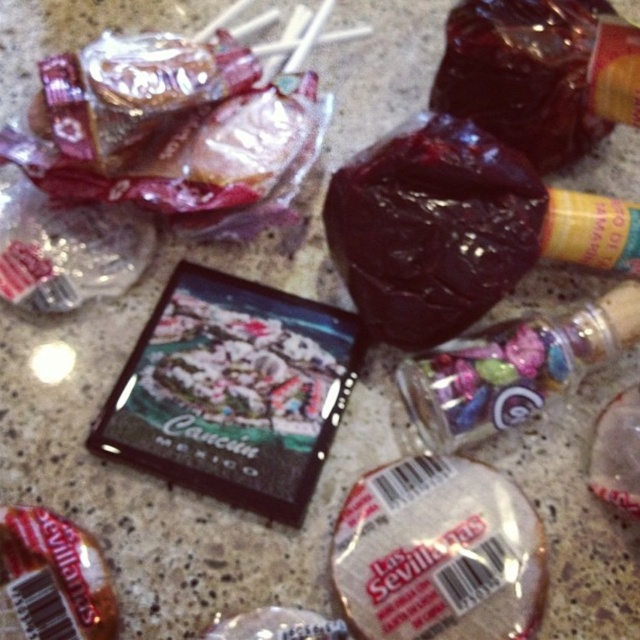
Question: Estimate the real-world distances between objects in this image. Which object is closer to the shiny dark chocolate at center?

Choices:
 (A) translucent glass jar at center-right
 (B) shiny dark red jelly at center

Answer: (A)

Question: Is white matte cookie at center bigger than translucent glass jar at center-right?

Choices:
 (A) yes
 (B) no

Answer: (B)

Question: In this image, where is shiny dark chocolate at center located relative to translucent glass jar at center-right?

Choices:
 (A) left
 (B) right

Answer: (A)

Question: Which object is positioned farthest from the shiny dark chocolate at center?

Choices:
 (A) shiny dark red jelly at center
 (B) white matte cookie at center
 (C) brown matte chocolate at center

Answer: (C)

Question: Which object appears closest to the camera in this image?

Choices:
 (A) shiny dark red jelly at center
 (B) brown matte chocolate at center
 (C) shiny dark chocolate at center

Answer: (B)

Question: Is white matte cookie at center positioned in front of shiny dark red jelly at center?

Choices:
 (A) yes
 (B) no

Answer: (A)